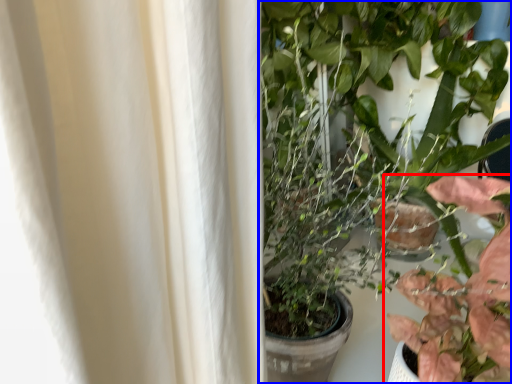
Question: Among these objects, which one is nearest to the camera, houseplant (highlighted by a red box) or houseplant (highlighted by a blue box)?

Choices:
 (A) houseplant
 (B) houseplant

Answer: (A)